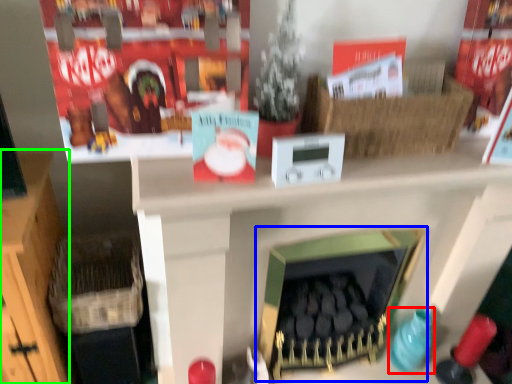
Question: Considering the real-world distances, which object is closest to toy (highlighted by a red box)? fireplace (highlighted by a blue box) or furniture (highlighted by a green box).

Choices:
 (A) fireplace
 (B) furniture

Answer: (A)